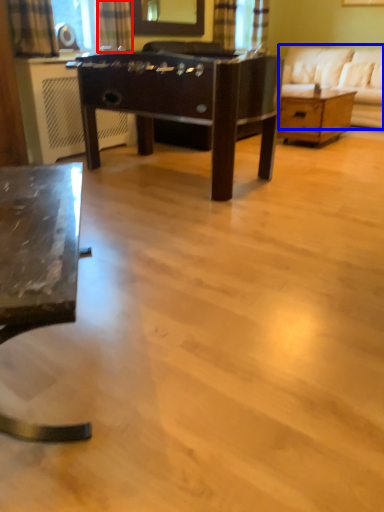
Question: Which point is closer to the camera, curtain (highlighted by a red box) or studio couch (highlighted by a blue box)?

Choices:
 (A) curtain
 (B) studio couch

Answer: (A)